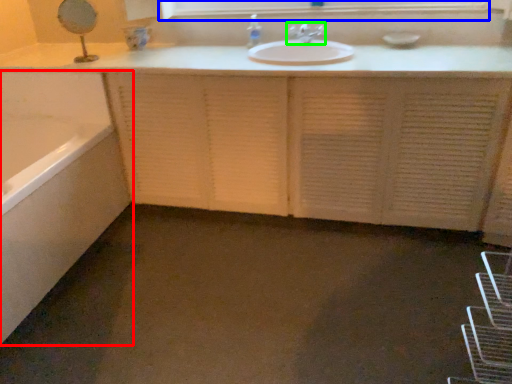
Question: Which object is positioned farthest from bathtub (highlighted by a red box)? Select from medicine cabinet (highlighted by a blue box) and tap (highlighted by a green box).

Choices:
 (A) medicine cabinet
 (B) tap

Answer: (B)